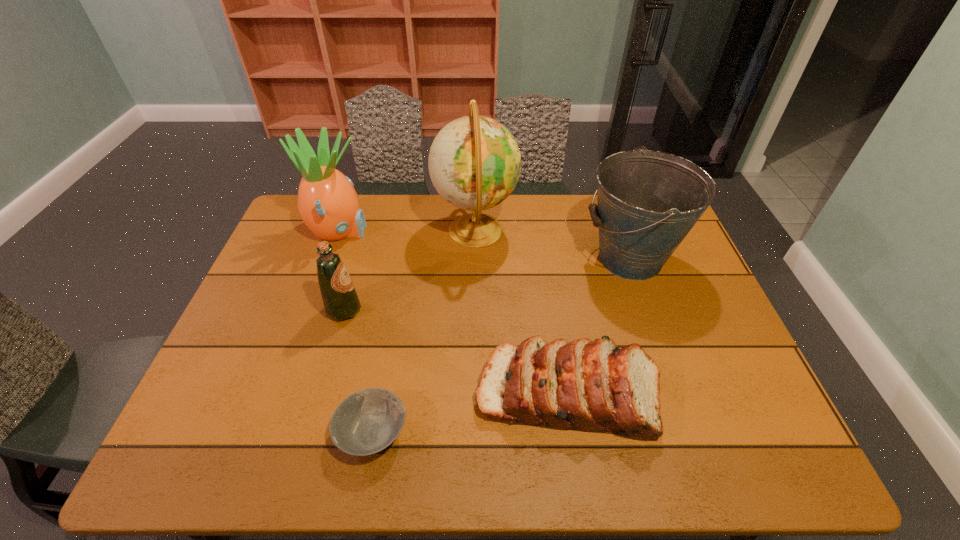
At what (x,y) coordinates should I click in order to perform the action: click on the tallest object. Please return your answer as a coordinate pair (x, y). Looking at the image, I should click on (474, 162).

The image size is (960, 540). Identify the location of pineapple. (327, 202).

Find the location of a particular element. bucket is located at coordinates (648, 201).

The image size is (960, 540). I want to click on the fourth farthest object, so click(340, 299).

Identify the location of olive oil. (340, 299).

In order to click on bread in this screenshot , I will do `click(594, 386)`.

Image resolution: width=960 pixels, height=540 pixels. In order to click on the fourth object from right to left in this screenshot , I will do `click(366, 422)`.

Locate an element on the screen. This screenshot has height=540, width=960. the shortest object is located at coordinates (366, 422).

Find the location of a particular element. blank space located 0.120m on the left of the globe is located at coordinates (398, 230).

The height and width of the screenshot is (540, 960). What are the coordinates of `vacant space positioned 0.220m at the entrance of the pineapple` in the screenshot? It's located at (435, 232).